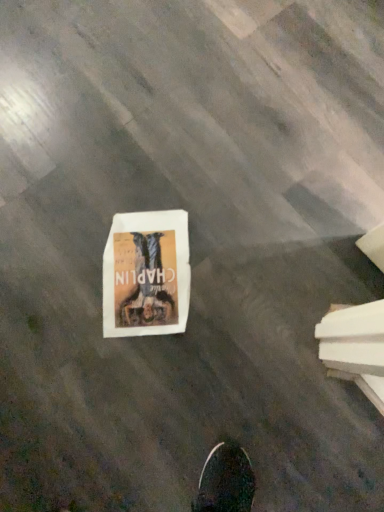
The width and height of the screenshot is (384, 512). Identify the location of unoccupied area in front of white paper comic book at center. (157, 362).